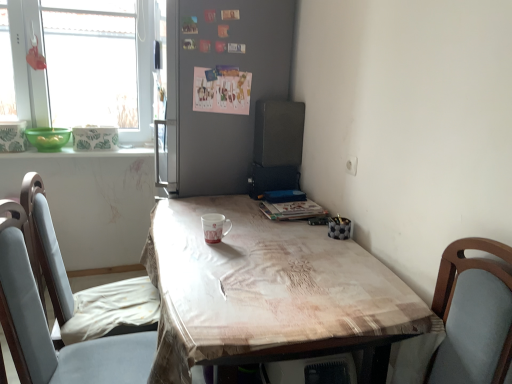
Question: Should I look upward or downward to see light blue fabric chair at lower left?

Choices:
 (A) down
 (B) up

Answer: (A)

Question: Can you confirm if green matte bowl at left is shorter than black matte speaker at upper right?

Choices:
 (A) no
 (B) yes

Answer: (B)

Question: Is green matte bowl at left positioned far away from black matte speaker at upper right?

Choices:
 (A) no
 (B) yes

Answer: (B)

Question: Is green matte bowl at left thinner than black matte speaker at upper right?

Choices:
 (A) no
 (B) yes

Answer: (A)

Question: From the image's perspective, is green matte bowl at left above black matte speaker at upper right?

Choices:
 (A) no
 (B) yes

Answer: (B)

Question: From the image's perspective, is green matte bowl at left under black matte speaker at upper right?

Choices:
 (A) no
 (B) yes

Answer: (A)

Question: Does green matte bowl at left have a greater width compared to black matte speaker at upper right?

Choices:
 (A) yes
 (B) no

Answer: (A)

Question: Does matte gray bulletin board at center have a lesser width compared to light blue fabric chair at lower left?

Choices:
 (A) yes
 (B) no

Answer: (B)

Question: Considering the relative sizes of matte gray bulletin board at center and light blue fabric chair at lower left in the image provided, is matte gray bulletin board at center wider than light blue fabric chair at lower left?

Choices:
 (A) yes
 (B) no

Answer: (A)

Question: From the image's perspective, does matte gray bulletin board at center appear higher than light blue fabric chair at lower left?

Choices:
 (A) no
 (B) yes

Answer: (B)

Question: Is matte gray bulletin board at center closer to the viewer compared to light blue fabric chair at lower left?

Choices:
 (A) yes
 (B) no

Answer: (B)

Question: Considering the relative sizes of matte gray bulletin board at center and light blue fabric chair at lower left in the image provided, is matte gray bulletin board at center taller than light blue fabric chair at lower left?

Choices:
 (A) yes
 (B) no

Answer: (A)

Question: From a real-world perspective, is matte gray bulletin board at center physically above light blue fabric chair at lower left?

Choices:
 (A) no
 (B) yes

Answer: (B)

Question: Is black matte speaker at upper right facing away from white glossy mug at center?

Choices:
 (A) yes
 (B) no

Answer: (B)